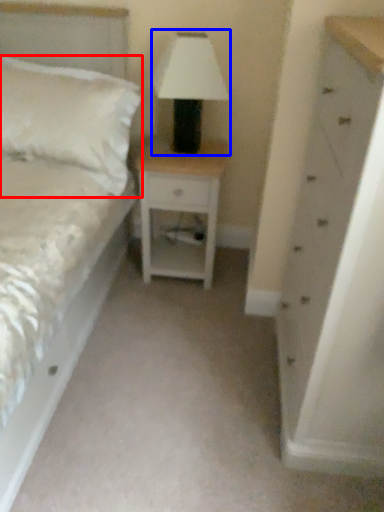
Question: Which point is closer to the camera, pillow (highlighted by a red box) or table lamp (highlighted by a blue box)?

Choices:
 (A) pillow
 (B) table lamp

Answer: (B)